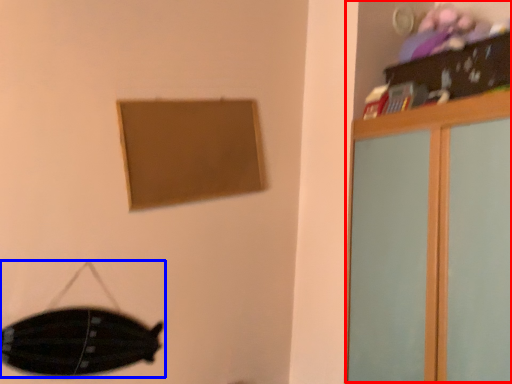
Question: Which object is closer to the camera taking this photo, dresser (highlighted by a red box) or swivel chair (highlighted by a blue box)?

Choices:
 (A) dresser
 (B) swivel chair

Answer: (A)